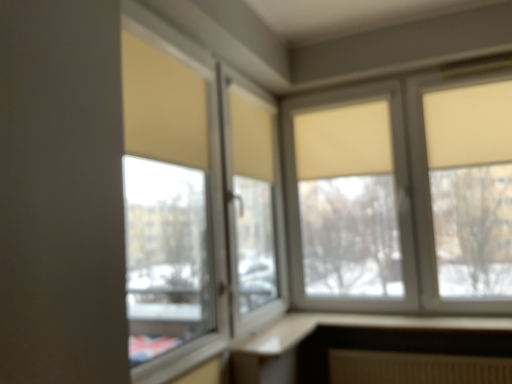
Question: Is matte glass window at center, which is the second window from back to front, behind beige fabric curtain at center?

Choices:
 (A) yes
 (B) no

Answer: (B)

Question: Can you confirm if matte glass window at center, which is the second window from back to front, is positioned to the right of beige fabric curtain at center?

Choices:
 (A) yes
 (B) no

Answer: (B)

Question: From a real-world perspective, is matte glass window at center, the 2th window from the right, over beige fabric curtain at center?

Choices:
 (A) no
 (B) yes

Answer: (A)

Question: From the image's perspective, would you say matte glass window at center, the 2th window from the right, is positioned over beige fabric curtain at center?

Choices:
 (A) no
 (B) yes

Answer: (A)

Question: Visually, is matte glass window at center, the 1th window from the front, positioned to the left or to the right of beige fabric curtain at center?

Choices:
 (A) right
 (B) left

Answer: (B)

Question: Considering their positions, is matte glass window at center, the 2th window from the right, located in front of or behind beige fabric curtain at center?

Choices:
 (A) behind
 (B) front

Answer: (B)

Question: Is matte glass window at center, which is counted as the 1th window, starting from the left, wider or thinner than beige fabric curtain at center?

Choices:
 (A) thin
 (B) wide

Answer: (B)

Question: From a real-world perspective, is matte glass window at center, which is the second window from back to front, positioned above or below beige fabric curtain at center?

Choices:
 (A) above
 (B) below

Answer: (B)

Question: In terms of size, does beige fabric curtain at center appear bigger or smaller than matte glass window at center, the 1th window from the front?

Choices:
 (A) small
 (B) big

Answer: (A)

Question: Is beige fabric curtain at center to the left or to the right of matte glass window at center, the 1th window from the front, in the image?

Choices:
 (A) left
 (B) right

Answer: (B)

Question: Is beige fabric curtain at center wider or thinner than matte glass window at center, the 2th window from the right?

Choices:
 (A) wide
 (B) thin

Answer: (B)

Question: In the image, is beige fabric curtain at center positioned in front of or behind matte glass window at center, which is counted as the 1th window, starting from the left?

Choices:
 (A) front
 (B) behind

Answer: (B)

Question: From their relative heights in the image, would you say matte glass window at center, which is counted as the 1th window, starting from the left, is taller or shorter than matte beige roller blinds at upper right, which is counted as the second window, starting from the left?

Choices:
 (A) tall
 (B) short

Answer: (A)

Question: Is point (266, 304) positioned closer to the camera than point (468, 241)?

Choices:
 (A) closer
 (B) farther

Answer: (B)